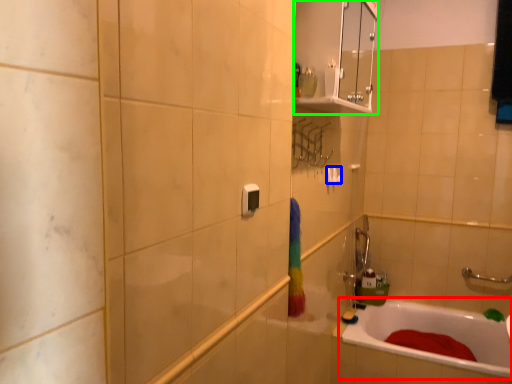
Question: Which object is the farthest from bathtub (highlighted by a red box)? Choose among these: towel bar (highlighted by a blue box) or medicine cabinet (highlighted by a green box).

Choices:
 (A) towel bar
 (B) medicine cabinet

Answer: (B)